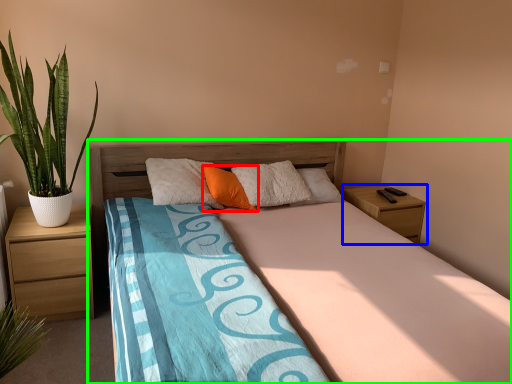
Question: Estimate the real-world distances between objects in this image. Which object is farther from pillow (highlighted by a red box), nightstand (highlighted by a blue box) or bed (highlighted by a green box)?

Choices:
 (A) nightstand
 (B) bed

Answer: (A)